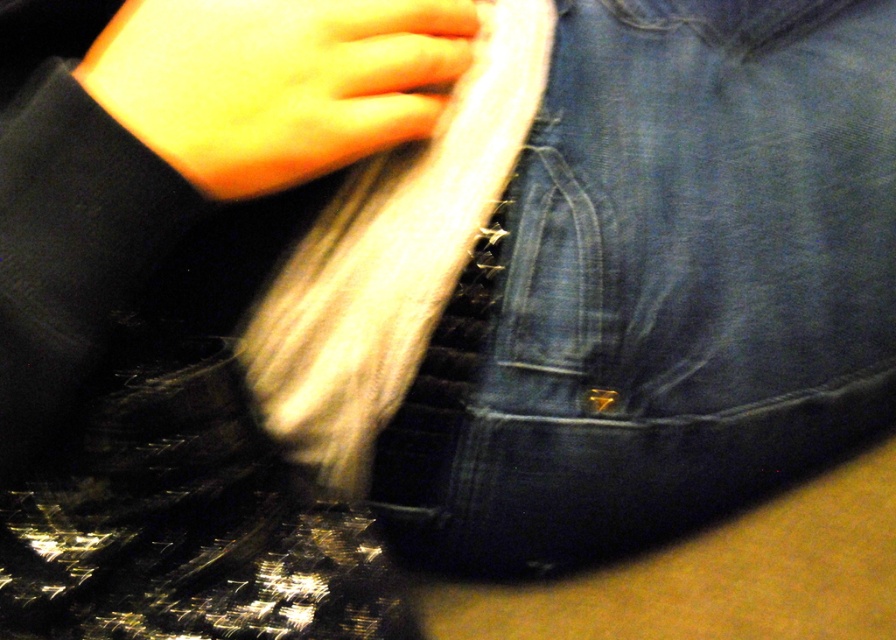
You are looking at the image and want to know which of the two points, point (441,380) or point (283,20), is closer to you. Can you tell?

Point (441,380) is closer to you than point (283,20) because it is further to the viewer according to the description.

You are a fashion designer observing the image. You need to decide which area requires more fabric for a new design. Based on the denim at center and the smooth yellow skin at upper center, which one needs more fabric?

The denim at center requires more fabric because it is bigger than the smooth yellow skin at upper center.